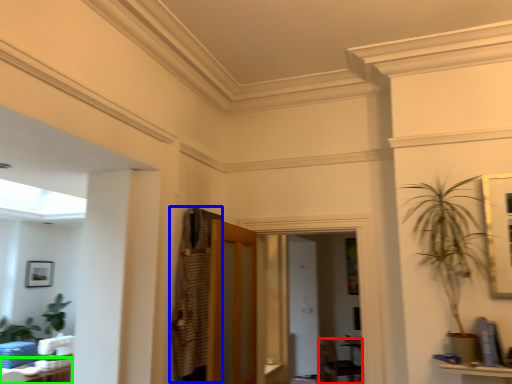
Question: Which object is positioned closest to armchair (highlighted by a red box)? Select from armoire (highlighted by a blue box) and table (highlighted by a green box).

Choices:
 (A) armoire
 (B) table

Answer: (B)